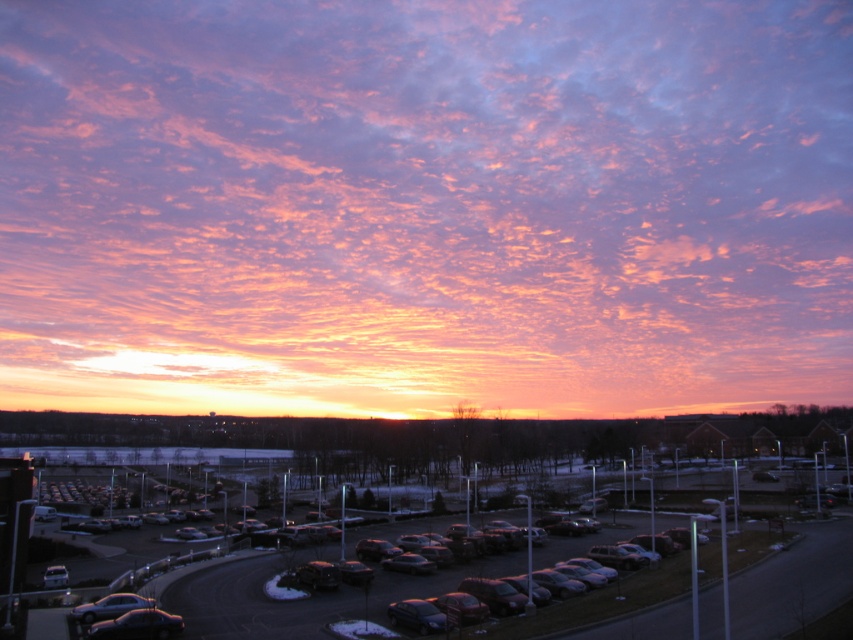
You are standing in the parking lot and want to take a photo of the pink fluffy clouds at upper center and the shiny black car at lower left. Which object will appear larger in your photo?

The pink fluffy clouds at upper center will appear larger in the photo because they are taller than the shiny black car at lower left.

You are standing at the edge of the parking lot and want to take a photo of the sunset. The black asphalt parking lot at lower center and the shiny black car at lower left are both in your view. Which object will appear larger in your photo?

The black asphalt parking lot at lower center appears much larger in the photo because it is taller than the shiny black car at lower left.